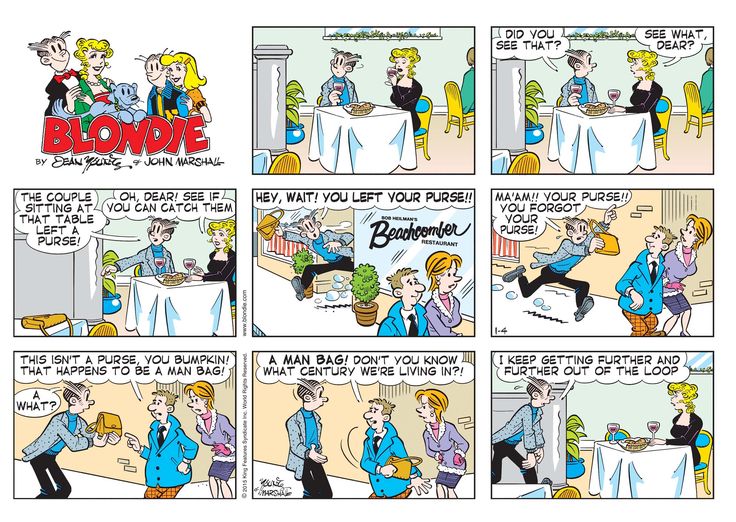
The image size is (736, 522). I want to click on frames of the blondie comic, so click(383, 89), click(601, 108), click(570, 246), click(388, 263), click(177, 268), click(143, 384), click(339, 429), click(637, 442).